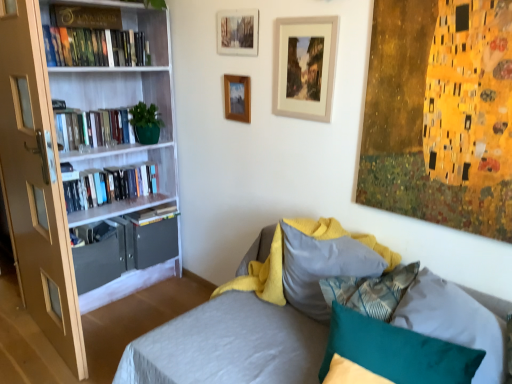
Locate an element on the screen. blank space above textured gray pillow at center, which is the 1th pillow from back to front (from a real-world perspective) is located at coordinates (318, 232).